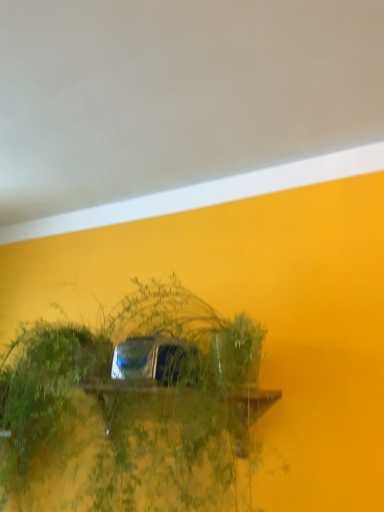
Question: From a real-world perspective, is matte yellow wall at upper center located higher than green leafy plant at center?

Choices:
 (A) no
 (B) yes

Answer: (B)

Question: Is matte yellow wall at upper center wider than green leafy plant at center?

Choices:
 (A) no
 (B) yes

Answer: (B)

Question: Is matte yellow wall at upper center aimed at green leafy plant at center?

Choices:
 (A) yes
 (B) no

Answer: (B)

Question: Considering the relative sizes of matte yellow wall at upper center and green leafy plant at center in the image provided, is matte yellow wall at upper center taller than green leafy plant at center?

Choices:
 (A) yes
 (B) no

Answer: (B)

Question: Does matte yellow wall at upper center come behind green leafy plant at center?

Choices:
 (A) no
 (B) yes

Answer: (A)

Question: Is matte yellow wall at upper center thinner than green leafy plant at center?

Choices:
 (A) no
 (B) yes

Answer: (A)

Question: Is green leafy plant at center bigger than matte yellow wall at upper center?

Choices:
 (A) yes
 (B) no

Answer: (A)

Question: Can you confirm if green leafy plant at center is shorter than matte yellow wall at upper center?

Choices:
 (A) no
 (B) yes

Answer: (A)

Question: Can we say green leafy plant at center lies outside matte yellow wall at upper center?

Choices:
 (A) yes
 (B) no

Answer: (A)

Question: Would you say green leafy plant at center contains matte yellow wall at upper center?

Choices:
 (A) no
 (B) yes

Answer: (A)

Question: From the image's perspective, is green leafy plant at center located above matte yellow wall at upper center?

Choices:
 (A) yes
 (B) no

Answer: (B)

Question: Is green leafy plant at center aimed at matte yellow wall at upper center?

Choices:
 (A) yes
 (B) no

Answer: (B)

Question: Would you say green leafy plant at center is to the left or to the right of matte yellow wall at upper center in the picture?

Choices:
 (A) left
 (B) right

Answer: (B)